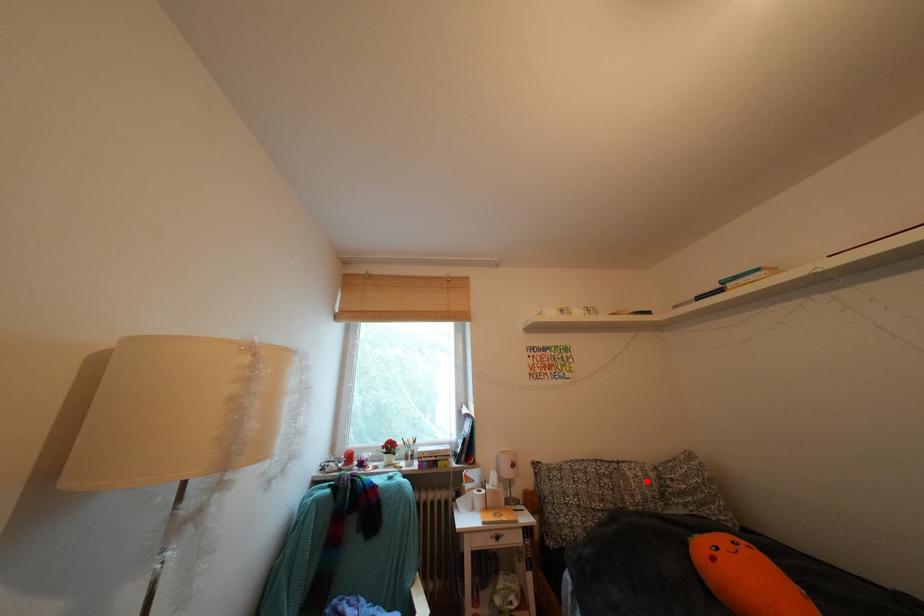
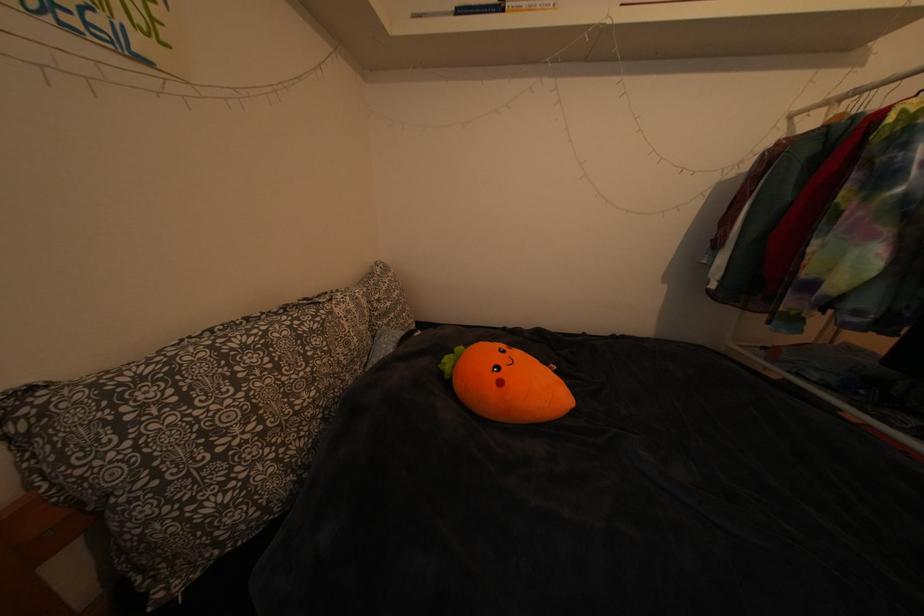
Question: I am providing you with two images of the same scene from different viewpoints. A red point is shown in image1. For the corresponding object point in image2, is it positioned nearer or farther from the camera?

Choices:
 (A) Nearer
 (B) Farther

Answer: (A)